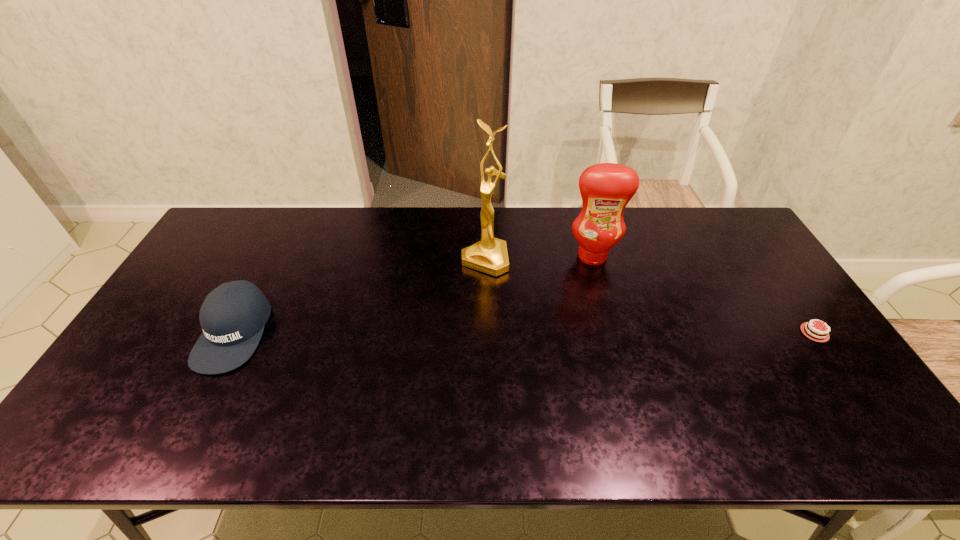
Where is `empty location between the baseball cap and the second tallest object`? empty location between the baseball cap and the second tallest object is located at coordinates (413, 294).

Identify the location of free area in between the baseball cap and the condiment. Image resolution: width=960 pixels, height=540 pixels. (413, 294).

Where is `unoccupied area between the baseball cap and the shortest object`? This screenshot has width=960, height=540. unoccupied area between the baseball cap and the shortest object is located at coordinates (524, 333).

Find the location of a particular element. object that is the closest to the rightmost object is located at coordinates (606, 188).

This screenshot has width=960, height=540. In order to click on object that is the nearest to the tallest object in this screenshot , I will do `click(606, 188)`.

Where is `vacant area in the image that satisfies the following two spatial constraints: 1. on the front-facing side of the rightmost object; 2. on the left side of the baseball cap`? The image size is (960, 540). vacant area in the image that satisfies the following two spatial constraints: 1. on the front-facing side of the rightmost object; 2. on the left side of the baseball cap is located at coordinates (233, 333).